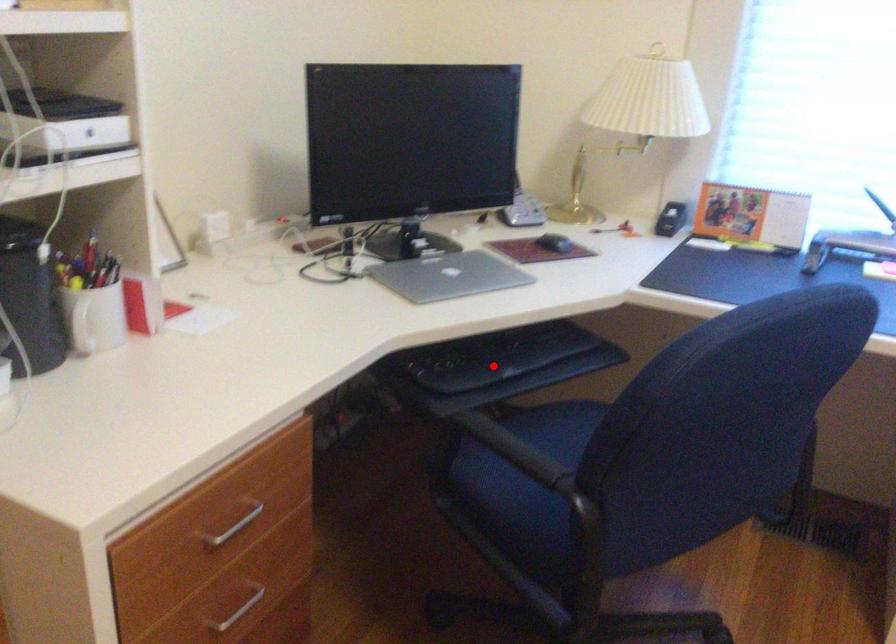
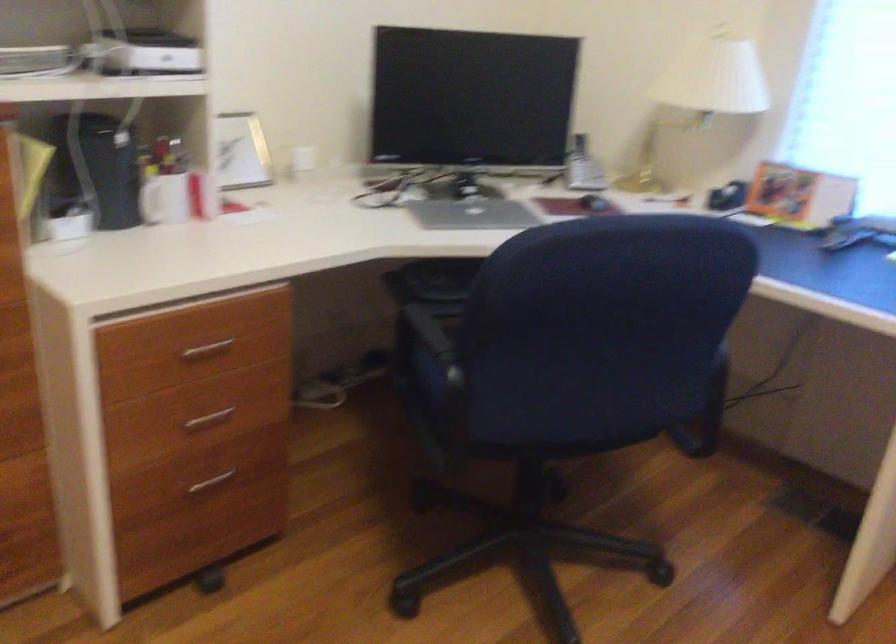
Question: I am providing you with two images of the same scene from different viewpoints. A red point is marked on the first image. At the location where the point appears in image 1, is it still visible in image 2?

Choices:
 (A) Yes
 (B) No

Answer: (B)